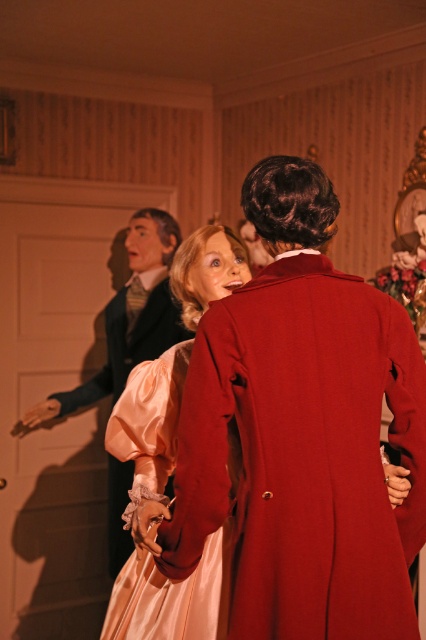
Can you confirm if silky pink dress at center is bigger than matte black coat at left?

Actually, silky pink dress at center might be smaller than matte black coat at left.

Does silky pink dress at center have a greater height compared to matte black coat at left?

In fact, silky pink dress at center may be shorter than matte black coat at left.

Find the location of a particular element. silky pink dress at center is located at coordinates (302, 433).

Is silky pink dress at center shorter than satin pink dress at center?

No.

Find the location of a particular element. The width and height of the screenshot is (426, 640). silky pink dress at center is located at coordinates (302, 433).

Can you confirm if silky peach dress at center is positioned to the right of satin pink dress at center?

Correct, you'll find silky peach dress at center to the right of satin pink dress at center.

Looking at this image, who is more forward, (218, 577) or (154, 349)?

Point (218, 577) is in front.

Measure the distance between point (x=183, y=630) and camera.

Point (x=183, y=630) is 5.30 feet from camera.

This screenshot has width=426, height=640. I want to click on silky peach dress at center, so click(172, 596).